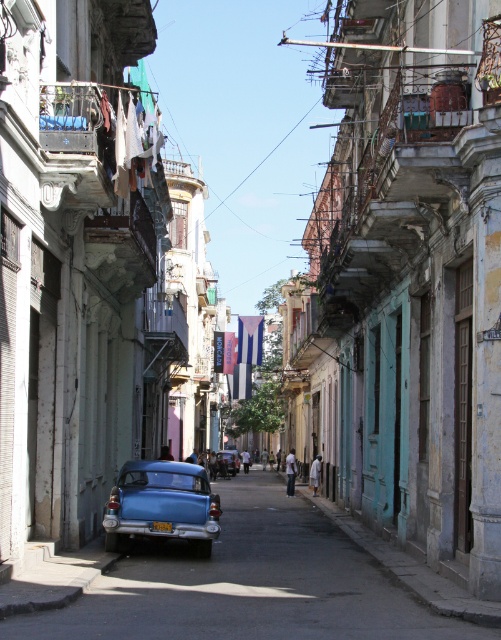
Does matte blue car at center appear under yellow plastic license plate at center?

Yes, matte blue car at center is below yellow plastic license plate at center.

Is point (165, 474) closer to viewer compared to point (162, 529)?

No, it is behind (162, 529).

Where is `matte blue car at center`? This screenshot has height=640, width=501. matte blue car at center is located at coordinates (161, 504).

Measure the distance between metallic blue car at center and camera.

metallic blue car at center is 32.41 feet away from camera.

Can you confirm if metallic blue car at center is taller than matte blue car at center?

Correct, metallic blue car at center is much taller as matte blue car at center.

From the picture: Who is more forward, (x=313, y=637) or (x=125, y=490)?

Point (x=313, y=637)

Find the location of a particular element. The height and width of the screenshot is (640, 501). metallic blue car at center is located at coordinates point(247,584).

Does metallic blue car at center appear over yellow plastic license plate at center?

Incorrect, metallic blue car at center is not positioned above yellow plastic license plate at center.

Measure the distance between metallic blue car at center and yellow plastic license plate at center.

metallic blue car at center is 5.62 meters away from yellow plastic license plate at center.

The image size is (501, 640). I want to click on metallic blue car at center, so click(247, 584).